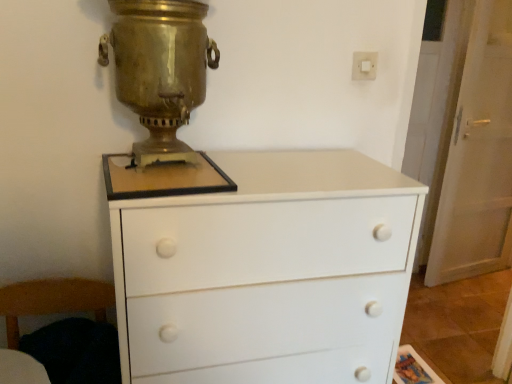
In order to click on white matte chest of drawers at center in this screenshot , I will do pyautogui.click(x=268, y=272).

What do you see at coordinates (478, 157) in the screenshot? The height and width of the screenshot is (384, 512). I see `white glossy door at right` at bounding box center [478, 157].

You are a GUI agent. You are given a task and a screenshot of the screen. Output one action in this format:
    pyautogui.click(x=<x>, y=<y>)
    Task: Click on the gold polished samovar at center
    This screenshot has height=384, width=512.
    Given the screenshot: What is the action you would take?
    pyautogui.click(x=160, y=70)

Looking at this image, what is the approximate height of white plastic switch at upper right?

white plastic switch at upper right is 8.31 centimeters in height.

What do you see at coordinates (65, 328) in the screenshot? I see `wooden armchair at lower left` at bounding box center [65, 328].

I want to click on white matte chest of drawers at center, so click(x=268, y=272).

How far apart are white glossy door at right and wooden armchair at lower left?

white glossy door at right is 7.41 feet away from wooden armchair at lower left.

Does white glossy door at right appear on the right side of wooden armchair at lower left?

Indeed, white glossy door at right is positioned on the right side of wooden armchair at lower left.

From a real-world perspective, is white glossy door at right under wooden armchair at lower left?

Incorrect, from a real-world perspective, white glossy door at right is higher than wooden armchair at lower left.

Identify the location of screen door above the wooden armchair at lower left (from a real-world perspective). (478, 157).

The image size is (512, 384). What are the coordinates of `electric outlet above the wooden armchair at lower left (from a real-world perspective)` in the screenshot? It's located at (364, 65).

Consider the image. From the image's perspective, would you say white plastic switch at upper right is shown under wooden armchair at lower left?

Incorrect, from the image's perspective, white plastic switch at upper right is higher than wooden armchair at lower left.

Do you think white plastic switch at upper right is within wooden armchair at lower left, or outside of it?

The correct answer is: outside.

How many degrees apart are the facing directions of white plastic switch at upper right and wooden armchair at lower left?

The angular difference between white plastic switch at upper right and wooden armchair at lower left is 0.436 degrees.

Between point (63, 357) and point (130, 65), which one is positioned in front?

Positioned in front is point (130, 65).

Considering the positions of objects wooden armchair at lower left and gold polished samovar at center in the image provided, who is more to the right, wooden armchair at lower left or gold polished samovar at center?

Positioned to the right is gold polished samovar at center.

In terms of height, does white plastic switch at upper right look taller or shorter compared to white matte chest of drawers at center?

In the image, white plastic switch at upper right appears to be shorter than white matte chest of drawers at center.

Does white plastic switch at upper right touch white matte chest of drawers at center?

white plastic switch at upper right and white matte chest of drawers at center are clearly separated.

Which object is thinner, white plastic switch at upper right or white matte chest of drawers at center?

With smaller width is white plastic switch at upper right.

Is point (368, 62) closer to camera compared to point (343, 338)?

No, it is behind (343, 338).

Is there a large distance between white matte chest of drawers at center and white plastic switch at upper right?

No, white matte chest of drawers at center is not far from white plastic switch at upper right.

Considering the sizes of white matte chest of drawers at center and white plastic switch at upper right in the image, is white matte chest of drawers at center taller or shorter than white plastic switch at upper right?

Clearly, white matte chest of drawers at center is taller compared to white plastic switch at upper right.

Which of these two, white matte chest of drawers at center or white plastic switch at upper right, is bigger?

white matte chest of drawers at center.

Does point (355, 54) come farther from viewer compared to point (496, 170)?

That is False.

Is white plastic switch at upper right looking in the opposite direction of white glossy door at right?

No, white plastic switch at upper right is not facing the opposite direction of white glossy door at right.

The image size is (512, 384). I want to click on electric outlet that appears above the white glossy door at right (from a real-world perspective), so 364,65.

From the image's perspective, is white plastic switch at upper right located beneath white glossy door at right?

No, from the image's perspective, white plastic switch at upper right is not beneath white glossy door at right.

Is the surface of gold polished samovar at center in direct contact with wooden armchair at lower left?

No, gold polished samovar at center is not touching wooden armchair at lower left.

Would you say wooden armchair at lower left is part of gold polished samovar at center's contents?

No, gold polished samovar at center does not contain wooden armchair at lower left.

Based on the photo, who is taller, gold polished samovar at center or wooden armchair at lower left?

gold polished samovar at center is taller.

From a real-world perspective, between gold polished samovar at center and wooden armchair at lower left, who is vertically higher?

gold polished samovar at center is physically above.

Identify the location of screen door above the wooden armchair at lower left (from a real-world perspective). (478, 157).

Find the location of `armchair on the left of white plastic switch at upper right`. armchair on the left of white plastic switch at upper right is located at coordinates (65, 328).

When comparing their distances from gold polished samovar at center, does white glossy door at right or white matte chest of drawers at center seem closer?

The object closer to gold polished samovar at center is white matte chest of drawers at center.

Considering their positions, is gold polished samovar at center positioned closer to white glossy door at right than white plastic switch at upper right?

white plastic switch at upper right is closer to white glossy door at right.

Considering their positions, is white matte chest of drawers at center positioned further to white plastic switch at upper right than white glossy door at right?

Based on the image, white glossy door at right appears to be further to white plastic switch at upper right.

Estimate the real-world distances between objects in this image. Which object is closer to gold polished samovar at center, white matte chest of drawers at center or white plastic switch at upper right?

Among the two, white matte chest of drawers at center is located nearer to gold polished samovar at center.

Estimate the real-world distances between objects in this image. Which object is closer to wooden armchair at lower left, gold polished samovar at center or white plastic switch at upper right?

Based on the image, gold polished samovar at center appears to be nearer to wooden armchair at lower left.

From the image, which object appears to be nearer to white matte chest of drawers at center, white glossy door at right or white plastic switch at upper right?

Among the two, white plastic switch at upper right is located nearer to white matte chest of drawers at center.

Which object lies nearer to the anchor point white matte chest of drawers at center, wooden armchair at lower left or white plastic switch at upper right?

wooden armchair at lower left is positioned closer to the anchor white matte chest of drawers at center.

Estimate the real-world distances between objects in this image. Which object is closer to white glossy door at right, white plastic switch at upper right or white matte chest of drawers at center?

white plastic switch at upper right.

What are the coordinates of `chest of drawers between white plastic switch at upper right and wooden armchair at lower left from top to bottom` in the screenshot? It's located at (268, 272).

The image size is (512, 384). Find the location of `electric outlet between gold polished samovar at center and white glossy door at right from left to right`. electric outlet between gold polished samovar at center and white glossy door at right from left to right is located at coordinates (364, 65).

Find the location of a particular element. The image size is (512, 384). chest of drawers between gold polished samovar at center and white glossy door at right from left to right is located at coordinates (268, 272).

Where is `electric outlet between white matte chest of drawers at center and white glossy door at right in the horizontal direction`? electric outlet between white matte chest of drawers at center and white glossy door at right in the horizontal direction is located at coordinates (364, 65).